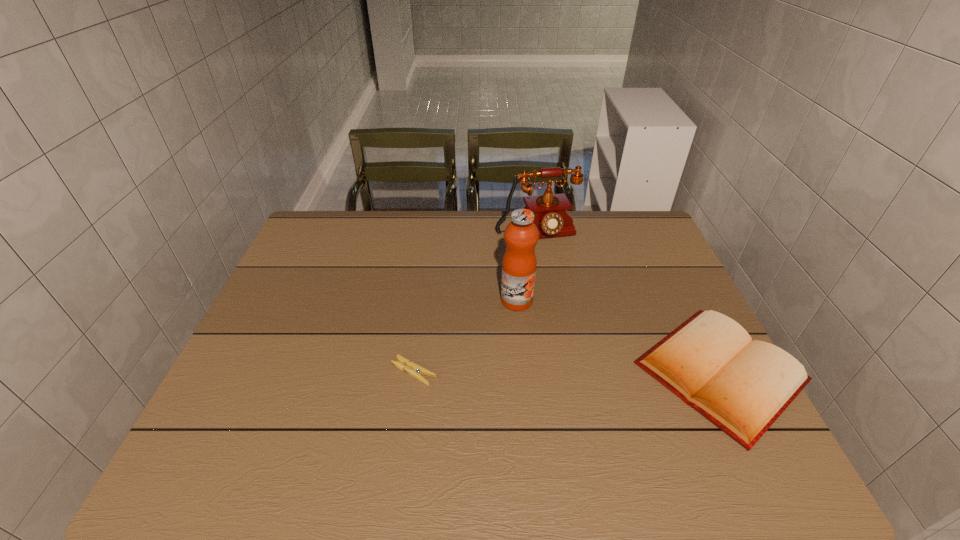
Locate an element on the screen. Image resolution: width=960 pixels, height=540 pixels. clothespin is located at coordinates (411, 368).

The height and width of the screenshot is (540, 960). What are the coordinates of `the shortest object` in the screenshot? It's located at (411, 368).

The height and width of the screenshot is (540, 960). Find the location of `Bible`. Bible is located at coordinates (742, 386).

You are a GUI agent. You are given a task and a screenshot of the screen. Output one action in this format:
    pyautogui.click(x=<x>, y=<y>)
    Task: Click on the second shortest object
    
    Given the screenshot: What is the action you would take?
    pyautogui.click(x=742, y=386)

The image size is (960, 540). Identify the location of telephone. click(x=552, y=219).

Locate an element on the screen. the second tallest object is located at coordinates (552, 219).

Locate an element on the screen. This screenshot has width=960, height=540. the second farthest object is located at coordinates (521, 235).

The image size is (960, 540). I want to click on fruit juice, so click(x=521, y=235).

Identify the location of vacant position located on the left of the shortest object. (301, 372).

Find the location of a particular element. free space located on the left of the Bible is located at coordinates (556, 372).